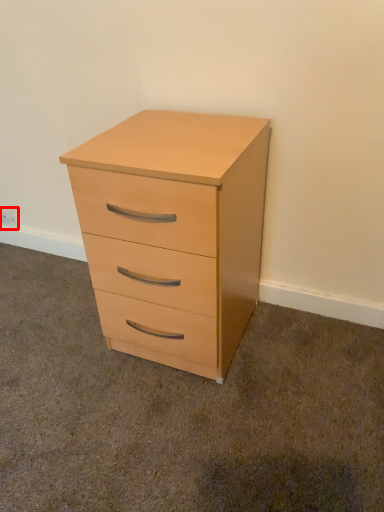
Question: In this image, where is electric outlet (annotated by the red box) located relative to chest of drawers?

Choices:
 (A) right
 (B) left

Answer: (B)